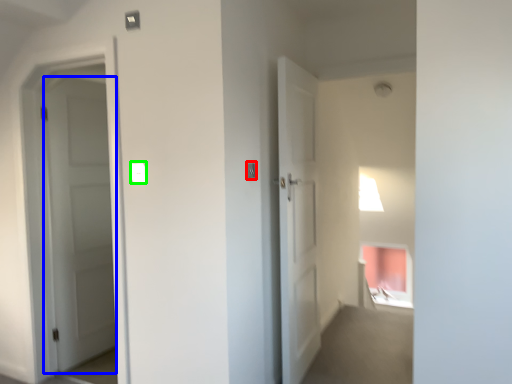
Question: Considering the real-world distances, which object is closest to light switch (highlighted by a red box)? door (highlighted by a blue box) or light switch (highlighted by a green box).

Choices:
 (A) door
 (B) light switch

Answer: (B)